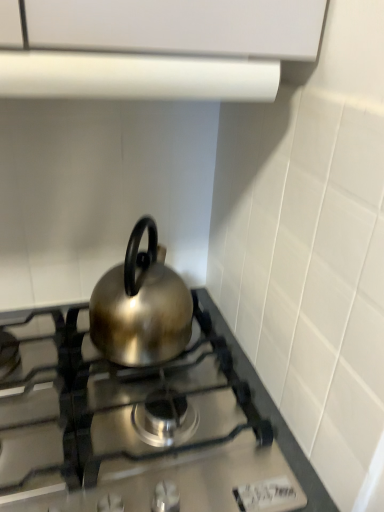
This screenshot has height=512, width=384. Describe the element at coordinates (141, 306) in the screenshot. I see `shiny metallic kettle at center` at that location.

Find the location of a particular element. The width and height of the screenshot is (384, 512). satin silver kettle at center is located at coordinates (131, 426).

This screenshot has height=512, width=384. I want to click on white matte vent at upper center, so click(158, 48).

From the image's perspective, which is above, satin silver kettle at center or shiny metallic kettle at center?

shiny metallic kettle at center is shown above in the image.

I want to click on gas stove below the shiny metallic kettle at center (from a real-world perspective), so click(131, 426).

Consider the image. Considering the sizes of objects satin silver kettle at center and shiny metallic kettle at center in the image provided, who is taller, satin silver kettle at center or shiny metallic kettle at center?

shiny metallic kettle at center is taller.

Can you confirm if shiny metallic kettle at center is positioned to the right of white matte vent at upper center?

No, shiny metallic kettle at center is not to the right of white matte vent at upper center.

Locate an element on the screen. The height and width of the screenshot is (512, 384). kettle below the white matte vent at upper center (from a real-world perspective) is located at coordinates (141, 306).

Based on the photo, measure the distance between shiny metallic kettle at center and white matte vent at upper center.

shiny metallic kettle at center is 12.47 inches from white matte vent at upper center.

Is shiny metallic kettle at center inside the boundaries of white matte vent at upper center, or outside?

shiny metallic kettle at center lies outside white matte vent at upper center.

Does shiny metallic kettle at center have a lesser width compared to satin silver kettle at center?

Yes.

Can you tell me how much shiny metallic kettle at center and satin silver kettle at center differ in facing direction?

shiny metallic kettle at center and satin silver kettle at center are facing 0.000285 degrees away from each other.

Can we say shiny metallic kettle at center lies outside satin silver kettle at center?

Yes.

Which object is closer to the camera taking this photo, satin silver kettle at center or white matte vent at upper center?

Positioned in front is white matte vent at upper center.

Considering the sizes of objects satin silver kettle at center and white matte vent at upper center in the image provided, who is smaller, satin silver kettle at center or white matte vent at upper center?

white matte vent at upper center is smaller.

Is satin silver kettle at center next to white matte vent at upper center and touching it?

No, satin silver kettle at center is not next to white matte vent at upper center.

Considering the sizes of satin silver kettle at center and white matte vent at upper center in the image, is satin silver kettle at center taller or shorter than white matte vent at upper center?

Considering their sizes, satin silver kettle at center has more height than white matte vent at upper center.

Find the location of a particular element. The width and height of the screenshot is (384, 512). gas stove on the left side of white matte vent at upper center is located at coordinates (x=131, y=426).

Visually, is white matte vent at upper center positioned to the left or to the right of satin silver kettle at center?

Clearly, white matte vent at upper center is on the right of satin silver kettle at center in the image.

Does point (162, 60) come farther from viewer compared to point (91, 426)?

No, (162, 60) is in front of (91, 426).

From a real-world perspective, which is physically below, white matte vent at upper center or satin silver kettle at center?

In real-world perspective, satin silver kettle at center is lower.

Which object is wider, white matte vent at upper center or shiny metallic kettle at center?

Wider between the two is white matte vent at upper center.

From the image's perspective, would you say white matte vent at upper center is shown under shiny metallic kettle at center?

Actually, white matte vent at upper center appears above shiny metallic kettle at center in the image.

Can you confirm if white matte vent at upper center is positioned to the right of shiny metallic kettle at center?

Yes.

You are a GUI agent. You are given a task and a screenshot of the screen. Output one action in this format:
    pyautogui.click(x=<x>, y=<y>)
    Task: Click on the gas stove that appears on the left of shiny metallic kettle at center
    The image size is (384, 512).
    Given the screenshot: What is the action you would take?
    pyautogui.click(x=131, y=426)

At what (x,y) coordinates should I click in order to perform the action: click on kettle below the white matte vent at upper center (from the image's perspective). Please return your answer as a coordinate pair (x, y). The width and height of the screenshot is (384, 512). Looking at the image, I should click on (141, 306).

Looking at the image, which one is located further to satin silver kettle at center, shiny metallic kettle at center or white matte vent at upper center?

The object further to satin silver kettle at center is white matte vent at upper center.

Considering their positions, is white matte vent at upper center positioned closer to satin silver kettle at center than shiny metallic kettle at center?

The object closer to satin silver kettle at center is shiny metallic kettle at center.

When comparing their distances from white matte vent at upper center, does satin silver kettle at center or shiny metallic kettle at center seem closer?

shiny metallic kettle at center is closer to white matte vent at upper center.

When comparing their distances from shiny metallic kettle at center, does white matte vent at upper center or satin silver kettle at center seem closer?

satin silver kettle at center is positioned closer to the anchor shiny metallic kettle at center.

Looking at the image, which one is located further to shiny metallic kettle at center, satin silver kettle at center or white matte vent at upper center?

white matte vent at upper center is further to shiny metallic kettle at center.

Considering their positions, is shiny metallic kettle at center positioned closer to white matte vent at upper center than satin silver kettle at center?

shiny metallic kettle at center.

In order to click on kettle between white matte vent at upper center and satin silver kettle at center in the vertical direction in this screenshot , I will do `click(141, 306)`.